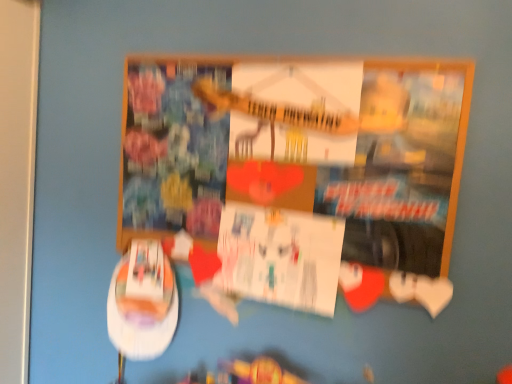
I want to click on wooden frame poster at center, so click(297, 176).

What do you see at coordinates (297, 176) in the screenshot? I see `wooden frame poster at center` at bounding box center [297, 176].

Locate an element on the screen. wooden frame poster at center is located at coordinates (297, 176).